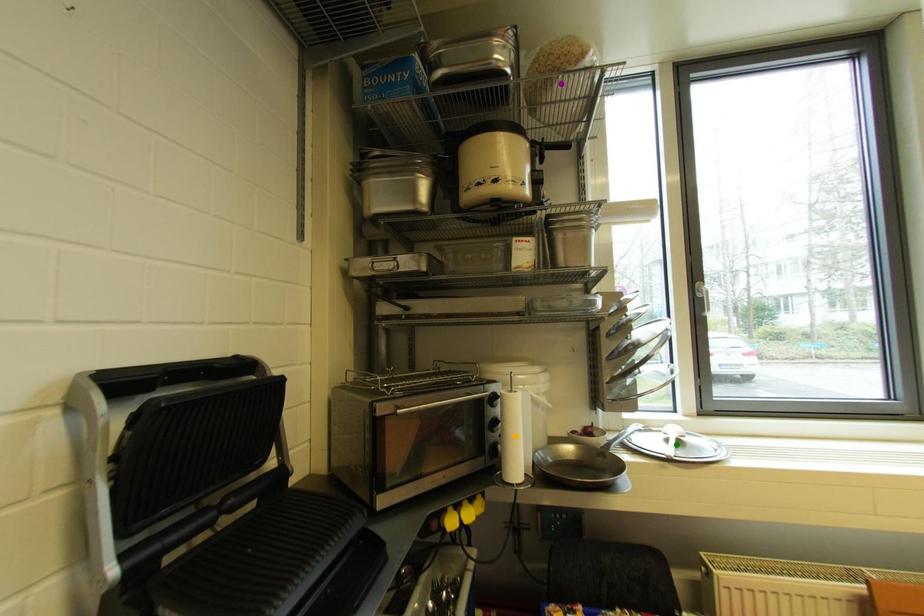
Order these from nearest to farthest:
A) orange point
B) purple point
C) green point

orange point, purple point, green point